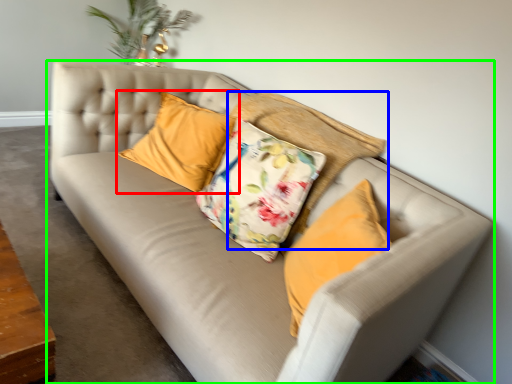
Question: Which object is positioned farthest from pillow (highlighted by a red box)? Select from pillow (highlighted by a blue box) and studio couch (highlighted by a green box).

Choices:
 (A) pillow
 (B) studio couch

Answer: (B)